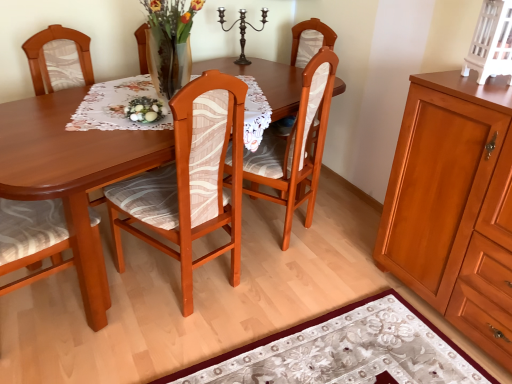
Where is `vacant space to the right of wooden chair at center, the third chair positioned from the left`? The width and height of the screenshot is (512, 384). vacant space to the right of wooden chair at center, the third chair positioned from the left is located at coordinates (341, 230).